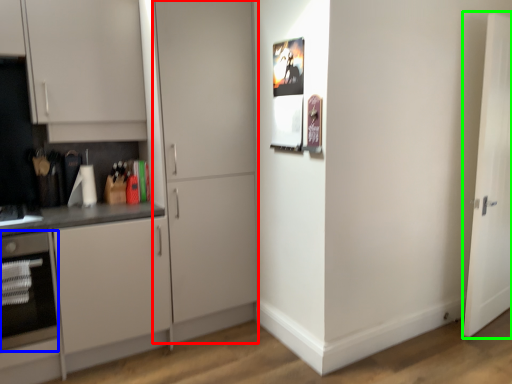
Question: Considering the real-world distances, which object is closest to door (highlighted by a red box)? oven (highlighted by a blue box) or door (highlighted by a green box).

Choices:
 (A) oven
 (B) door

Answer: (A)